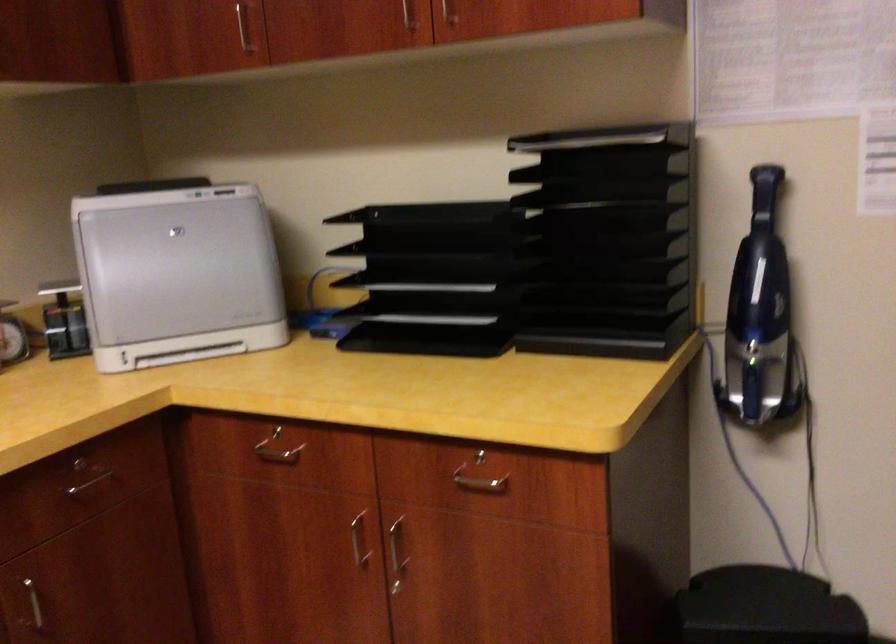
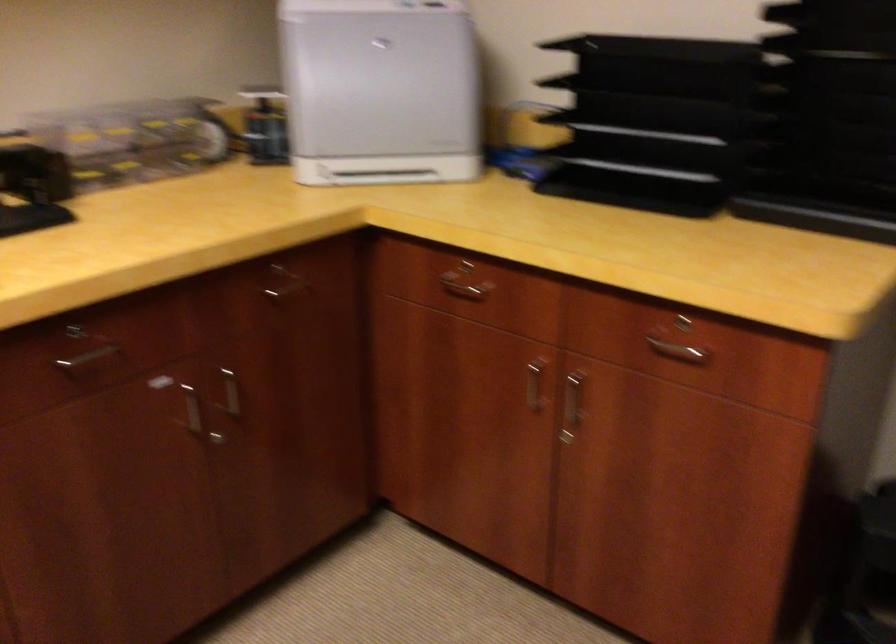
The point at (398, 550) is marked in the first image. Where is the corresponding point in the second image?

(572, 401)